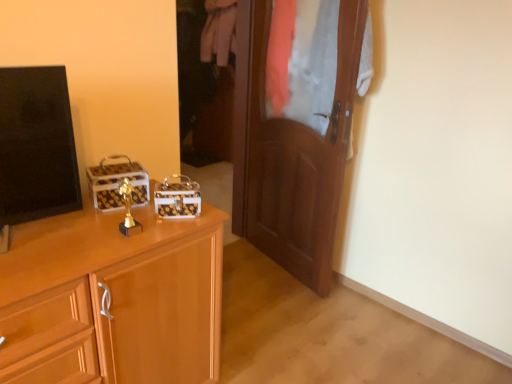
Where is `vacant area in front of wooden door at center`? The width and height of the screenshot is (512, 384). vacant area in front of wooden door at center is located at coordinates (291, 313).